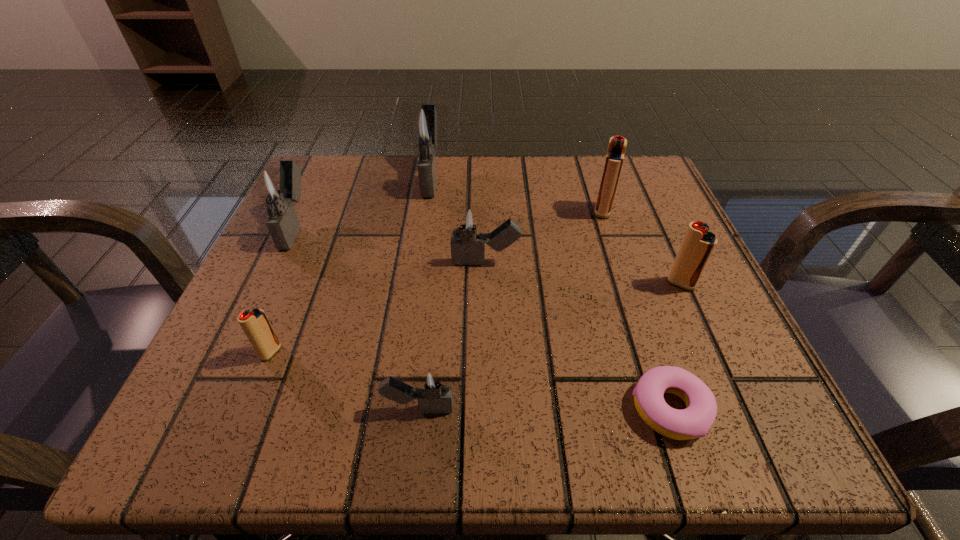
What are the coordinates of `vacant space at the left edge of the desktop` in the screenshot? It's located at (330, 255).

Locate an element on the screen. vacant space at the right edge of the desktop is located at coordinates (627, 225).

You are a GUI agent. You are given a task and a screenshot of the screen. Output one action in this format:
    pyautogui.click(x=<x>, y=<y>)
    Task: Click on the vacant space at the far left corner
    This screenshot has height=540, width=960.
    Given the screenshot: What is the action you would take?
    pyautogui.click(x=372, y=162)

Where is `vacant space at the near left corner of the desktop`? The width and height of the screenshot is (960, 540). vacant space at the near left corner of the desktop is located at coordinates (209, 418).

Find the location of a particular element. The width and height of the screenshot is (960, 540). vacant space at the far right corner of the desktop is located at coordinates (590, 169).

Identify the location of unoccupied position between the second red igniter from right to left and the third biggest gray igniter. This screenshot has width=960, height=540. (544, 237).

Where is `empty space that is in between the second igniter from right to left and the smallest red igniter`? This screenshot has height=540, width=960. empty space that is in between the second igniter from right to left and the smallest red igniter is located at coordinates (437, 281).

Where is `vacant space that is in between the nearest gray igniter and the third biggest gray igniter`? vacant space that is in between the nearest gray igniter and the third biggest gray igniter is located at coordinates (452, 335).

The image size is (960, 540). Find the location of `free area in between the leftmost gray igniter and the doughnut`. free area in between the leftmost gray igniter and the doughnut is located at coordinates (483, 318).

At what (x,y) coordinates should I click in order to perform the action: click on unoccupied area between the smallest gray igniter and the third smallest gray igniter. Please return your answer as a coordinate pair (x, y). Looking at the image, I should click on (357, 318).